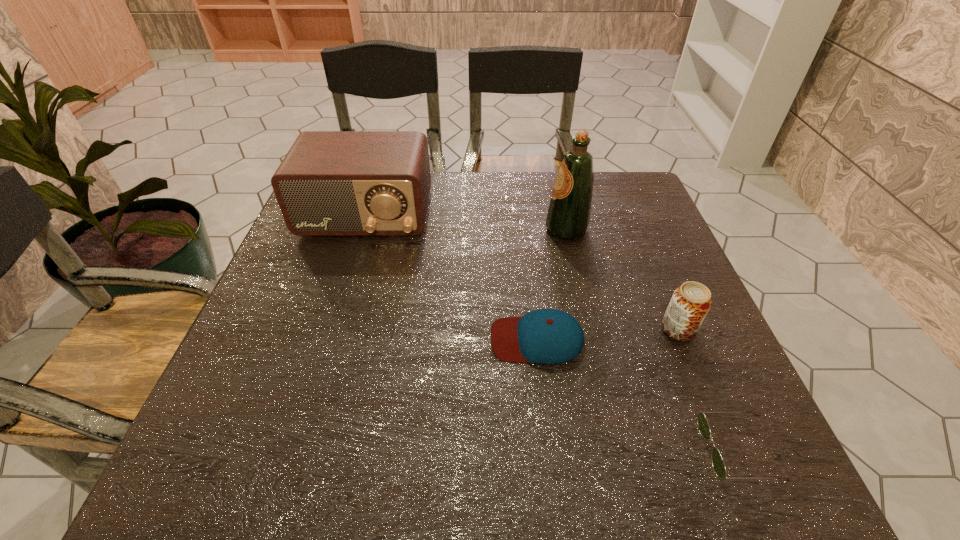
At what (x,y) coordinates should I click in order to perform the action: click on object present at the near edge. Please return your answer as a coordinate pair (x, y). Looking at the image, I should click on (718, 464).

This screenshot has width=960, height=540. In order to click on object located in the left edge section of the desktop in this screenshot , I will do `click(331, 183)`.

Identify the location of beer can positioned at the right edge. (690, 303).

Where is `sunglasses that is at the right edge`? sunglasses that is at the right edge is located at coordinates (718, 464).

Locate an element on the screen. The image size is (960, 540). object at the far left corner is located at coordinates (331, 183).

What are the coordinates of `object present at the near right corner` in the screenshot? It's located at (718, 464).

Identify the location of vacant region at the far edge. (522, 210).

Locate an element on the screen. free space at the near edge of the desktop is located at coordinates (601, 462).

I want to click on vacant space at the left edge of the desktop, so click(x=295, y=268).

The height and width of the screenshot is (540, 960). I want to click on vacant region at the right edge of the desktop, so click(x=707, y=332).